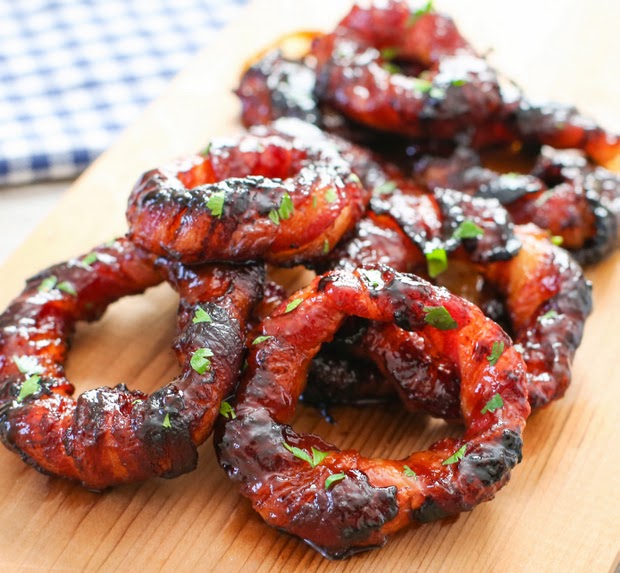
The height and width of the screenshot is (573, 620). I want to click on light corner, so click(x=558, y=31).